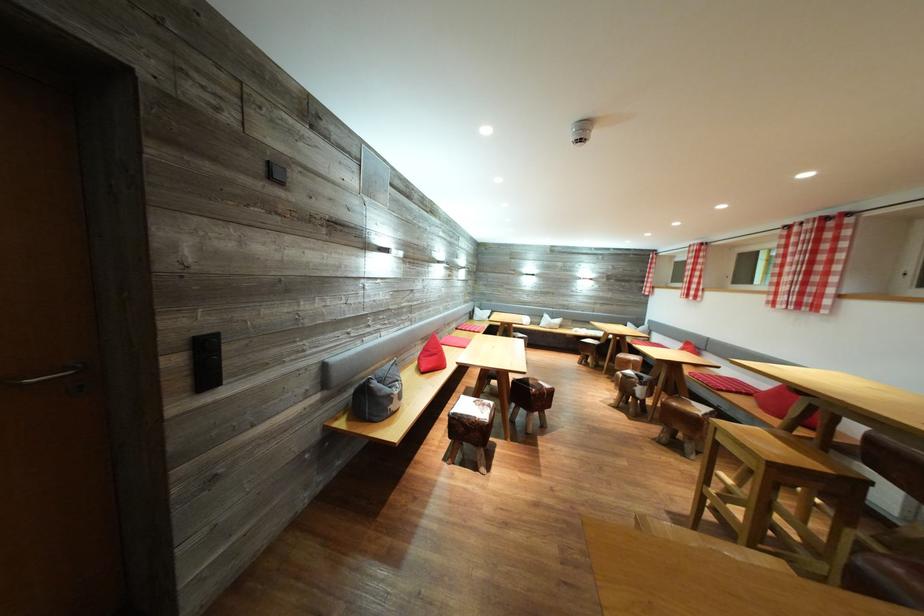
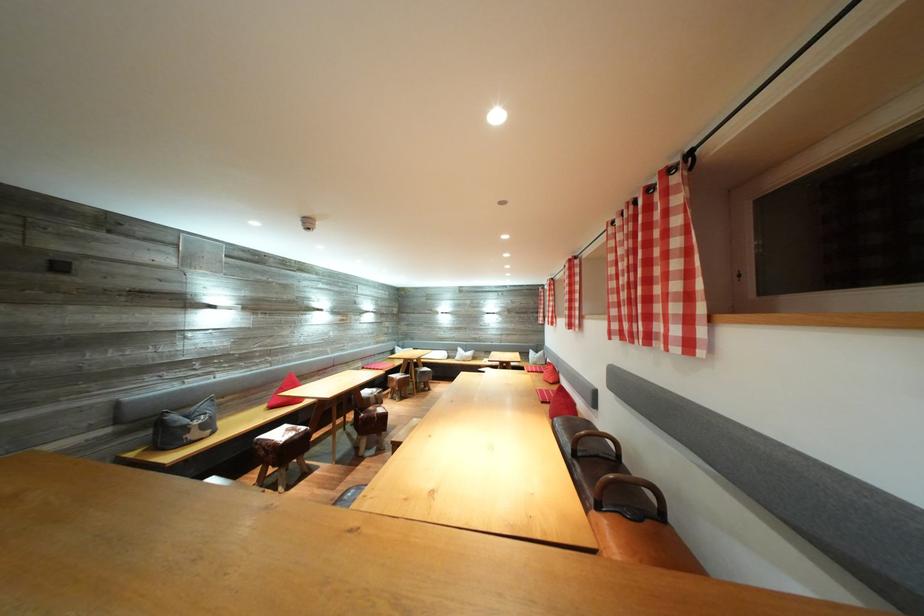
Find the pixel in the second image that matches point 679,253 in the first image.

(553, 288)